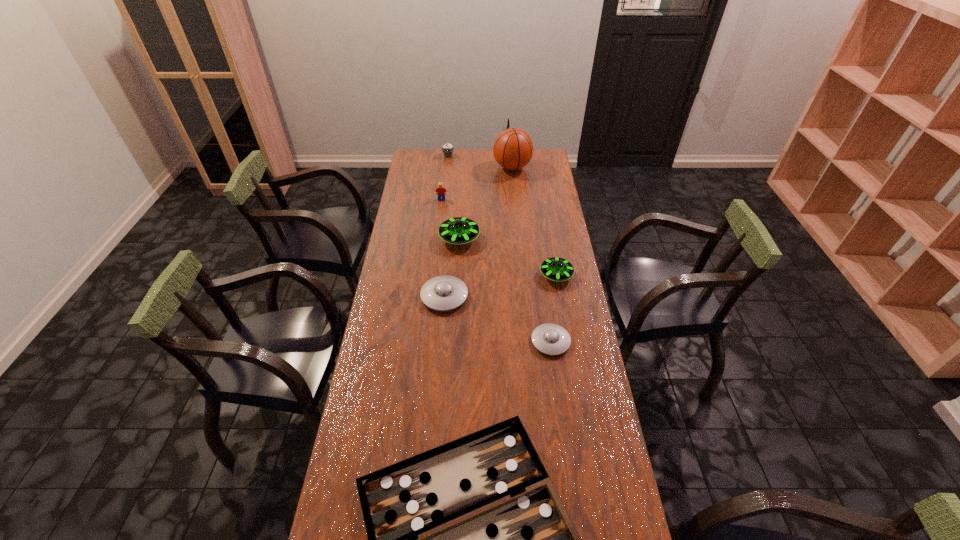
The width and height of the screenshot is (960, 540). In order to click on the seventh farthest object in this screenshot , I will do `click(551, 339)`.

Where is `free point located 0.150m on the left of the basketball`? The width and height of the screenshot is (960, 540). free point located 0.150m on the left of the basketball is located at coordinates (465, 167).

What are the coordinates of `vacant space located 0.110m on the front of the cupcake` in the screenshot? It's located at (446, 170).

Identify the location of vacant region located on the face of the third farthest object. The height and width of the screenshot is (540, 960). (436, 256).

Where is `free space located on the back of the left green saucer`? free space located on the back of the left green saucer is located at coordinates (462, 188).

Find the location of a particular element. This screenshot has width=960, height=540. free spot located on the left of the right green saucer is located at coordinates (482, 275).

Find the location of a particular element. The width and height of the screenshot is (960, 540). vacant point located 0.090m on the front of the farther gray saucer is located at coordinates (442, 334).

In order to click on free space located 0.140m on the left of the shortest saucer in this screenshot , I will do [492, 341].

Identify the location of basketball at the far edge. (513, 148).

The image size is (960, 540). Find the location of `cupcake that is at the far edge`. cupcake that is at the far edge is located at coordinates (447, 149).